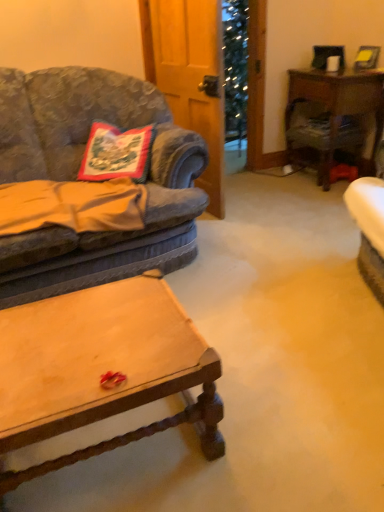
This screenshot has height=512, width=384. What are the coordinates of `vacant region to the right of wooden coffee table at center` in the screenshot? It's located at (271, 410).